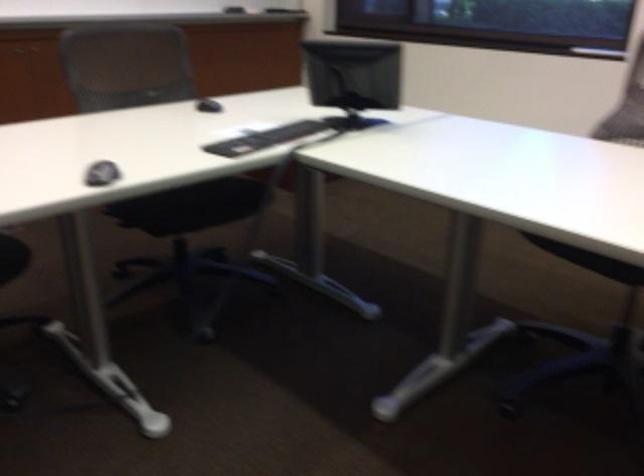
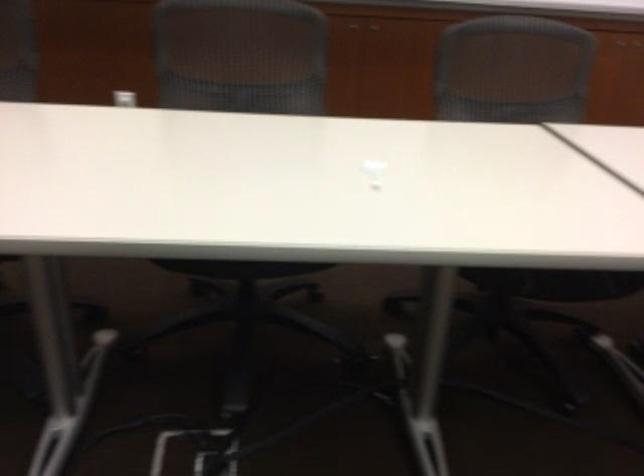
Question: The images are taken continuously from a first-person perspective. In which direction is your viewpoint rotating?

Choices:
 (A) Left
 (B) Right
 (C) Up
 (D) Down

Answer: (A)